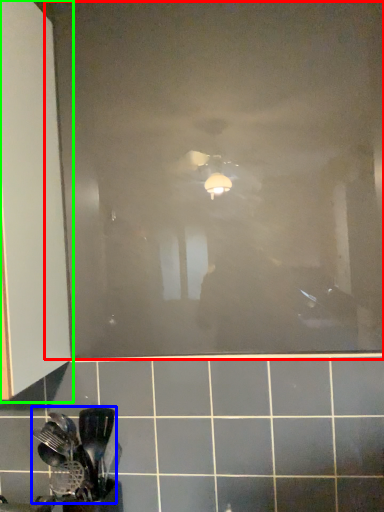
Question: Which object is the farthest from glass door (highlighted by a red box)? Choose among these: spatula (highlighted by a blue box) or cabinetry (highlighted by a green box).

Choices:
 (A) spatula
 (B) cabinetry

Answer: (A)